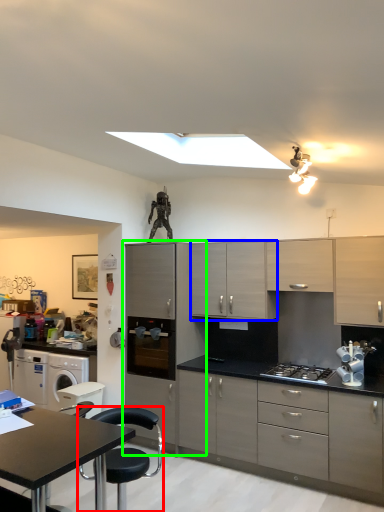
Question: Which object is positioned closest to chair (highlighted by a red box)? Select from cabinetry (highlighted by a blue box) and cabinetry (highlighted by a green box).

Choices:
 (A) cabinetry
 (B) cabinetry

Answer: (B)